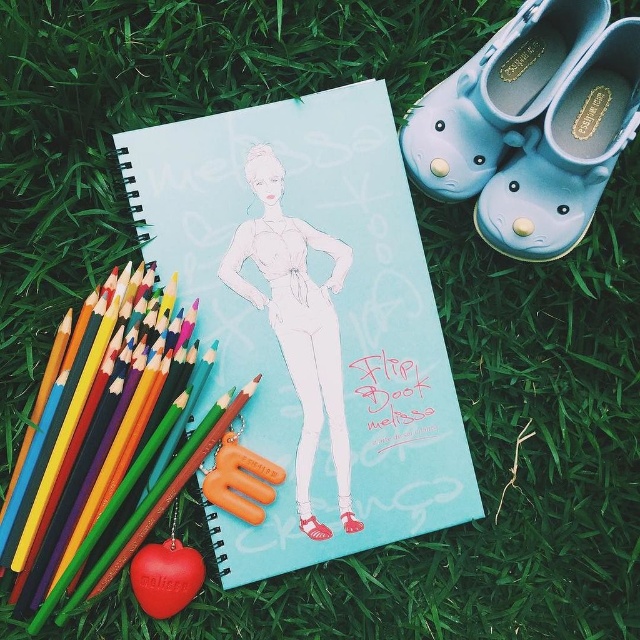
You have a small box that can only hold items narrower than 2 cm. You need to place either the matte wooden pencil at lower left or the light blue rubber shoe at upper right into the box. Based on their widths, which item should you choose?

The light blue rubber shoe at upper right should be chosen because the matte wooden pencil at lower left might be wider than it, making the pencil too wide for the box.

You are an artist holding a new sketch. You need to place it either on the white paper at center or the light blue rubber shoe at upper right. Which surface is closer to you for placing your sketch?

The white paper at center is closer to you than the light blue rubber shoe at upper right, so you should place your sketch on the white paper at center.

From the picture: You are standing in front of the scene described. You want to place a 1.2 meter long ruler between the light blue paper at center and the colorful pencils on the left. Is there enough space to lay the ruler flat without bending it?

The distance between the light blue paper at center and the viewer is 1.09 meters. Since the ruler is 1.2 meters long, it would not fit within the available space. You would need a shorter ruler or more space to lay it flat.